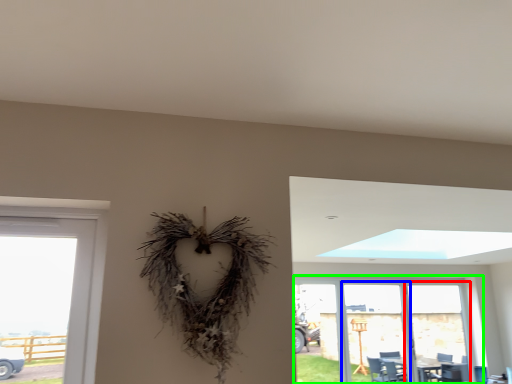
Question: Estimate the real-world distances between objects in this image. Which object is farther from screen door (highlighted by a red box), screen door (highlighted by a blue box) or window (highlighted by a green box)?

Choices:
 (A) screen door
 (B) window

Answer: (A)